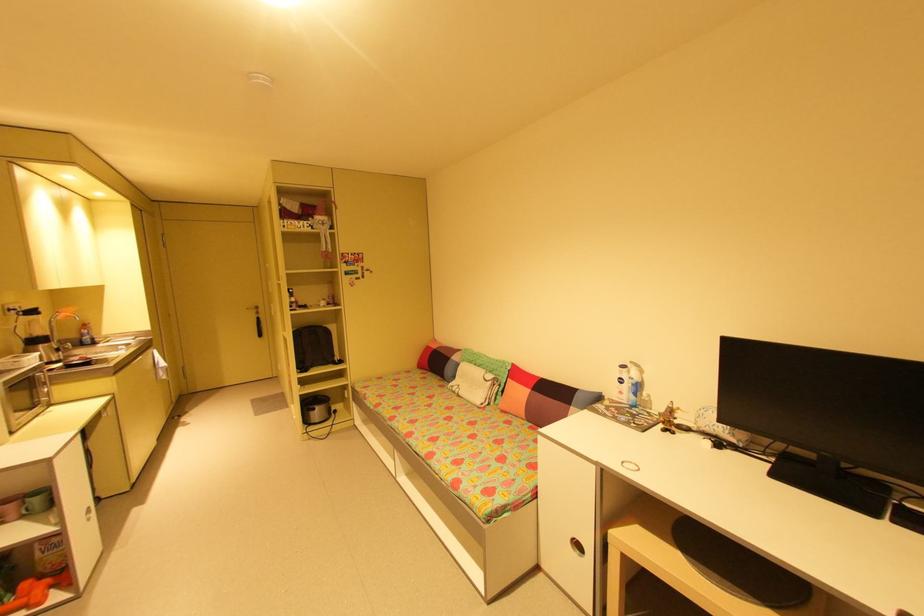
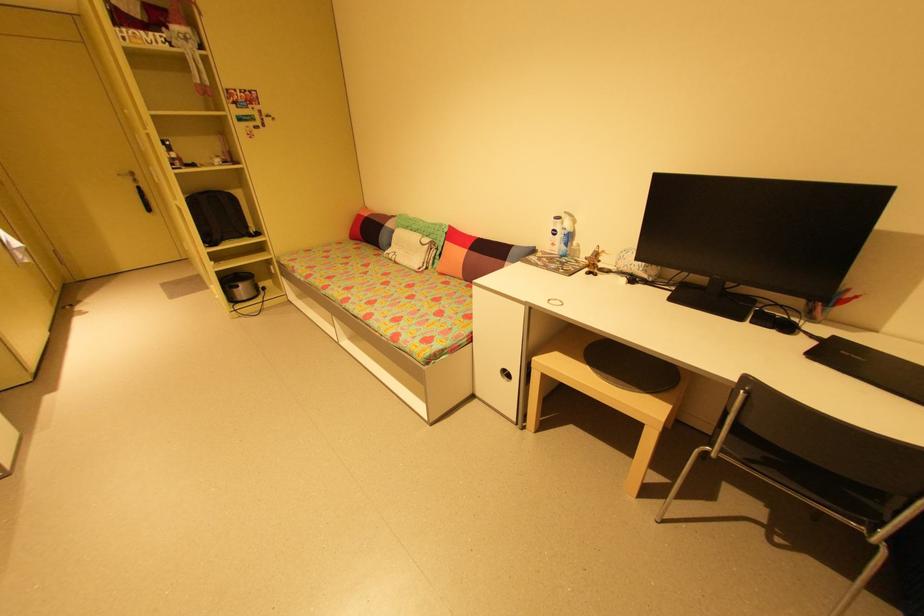
Locate, in the second image, the point that corresponds to pixel 582 546 in the first image.

(512, 375)